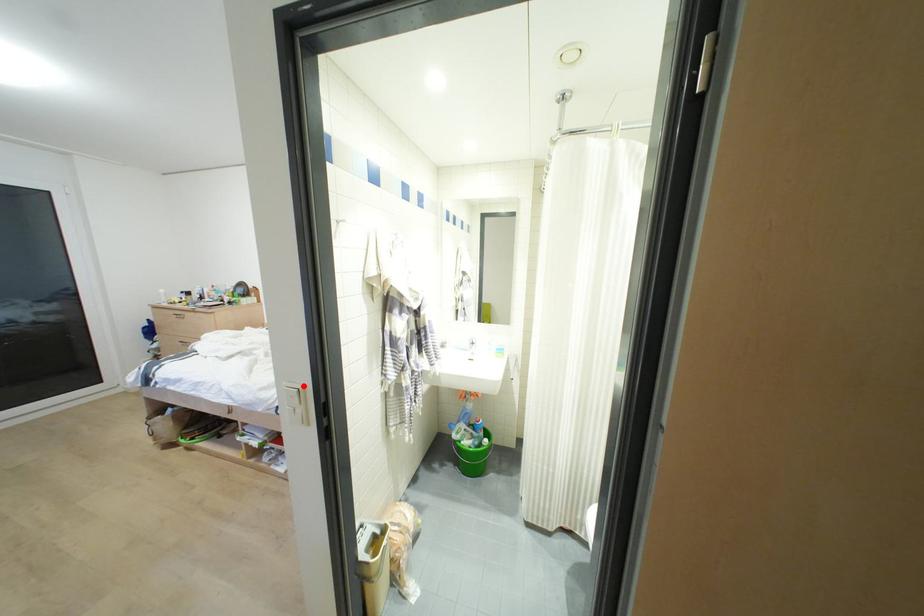
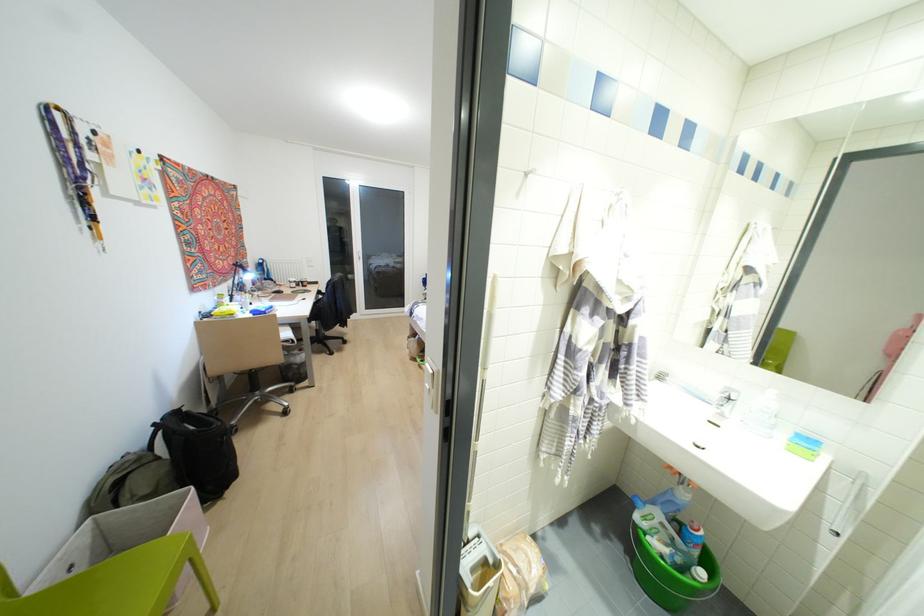
The point at the highlighted location is marked in the first image. Where is the corresponding point in the second image?

(438, 371)